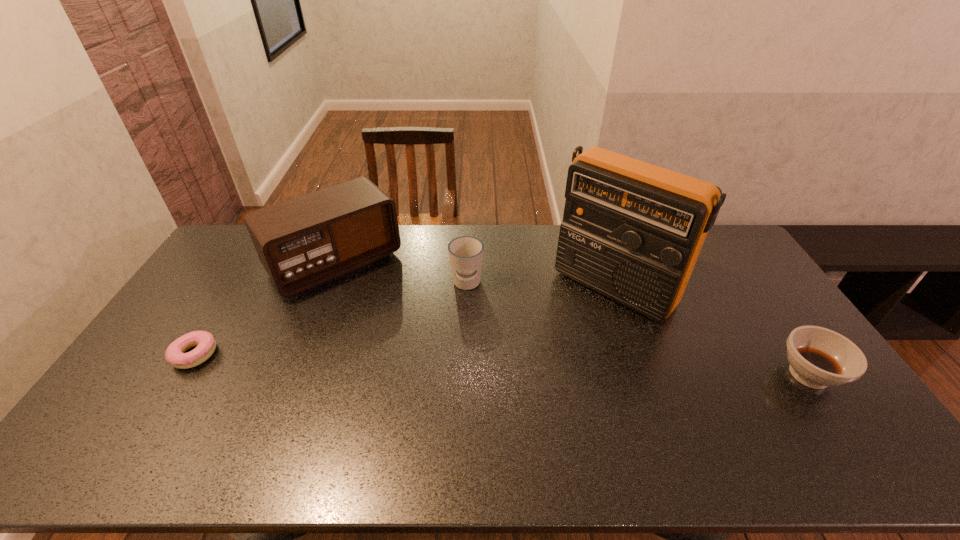
You are a GUI agent. You are given a task and a screenshot of the screen. Output one action in this format:
    pyautogui.click(x=<x>, y=<y>)
    Task: Click on the free region that satisfies the following two spatial constraints: 1. on the front side of the taller radio receiver; 2. on the right side of the third shortest object
    The height and width of the screenshot is (540, 960).
    Given the screenshot: What is the action you would take?
    pyautogui.click(x=467, y=288)

Locate an element on the screen. This screenshot has height=540, width=960. free location that satisfies the following two spatial constraints: 1. on the front side of the tallest object; 2. on the left side of the soup bowl is located at coordinates (643, 375).

Find the location of a particular element. blank area in the image that satisfies the following two spatial constraints: 1. on the front side of the taller radio receiver; 2. on the left side of the third shortest object is located at coordinates (467, 288).